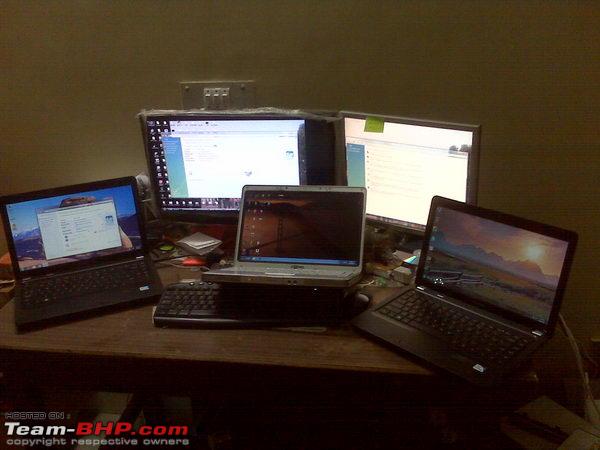
Locate an element on the screen. table is located at coordinates (350, 356).